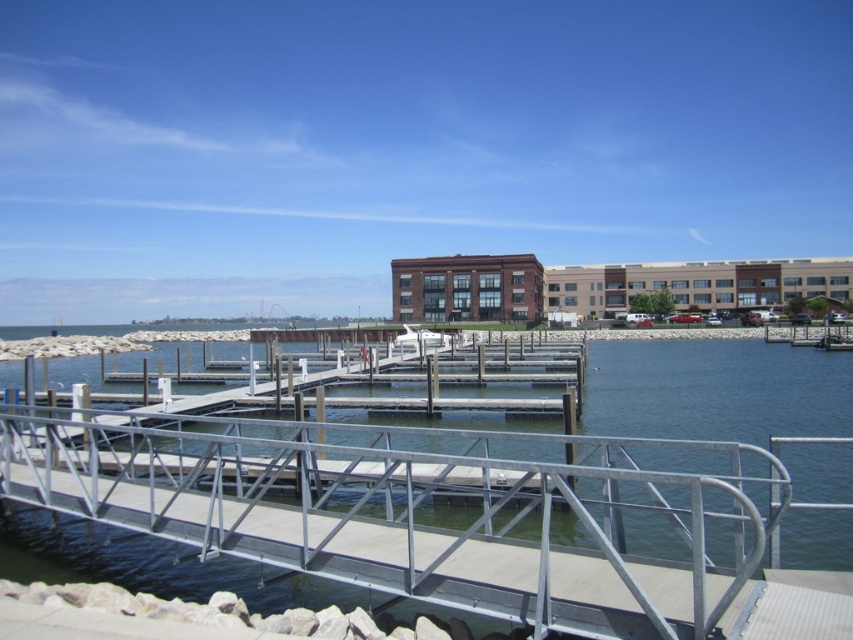
Does point (718, 454) come farther from viewer compared to point (415, 336)?

No, it is not.

Is silver metallic rail at center wider than white glossy boat at center?

Yes.

Measure the distance between silver metallic rail at center and camera.

The distance of silver metallic rail at center from camera is 3.73 meters.

Where is `silver metallic rail at center`? The width and height of the screenshot is (853, 640). silver metallic rail at center is located at coordinates (424, 509).